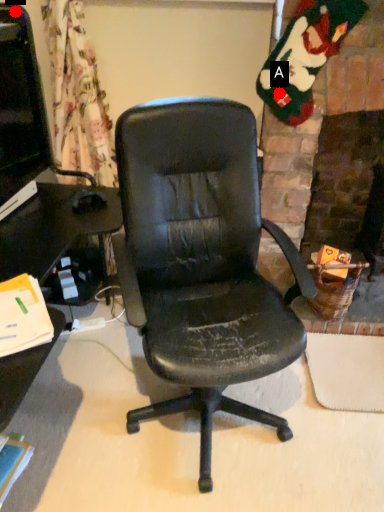
Question: Two points are circled on the image, labeled by A and B beside each circle. Among these points, which one is nearest to the camera?

Choices:
 (A) A is closer
 (B) B is closer

Answer: (B)